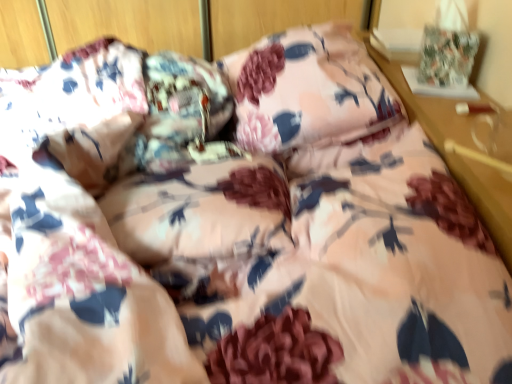
The width and height of the screenshot is (512, 384). I want to click on floral fabric pillow at center, so click(308, 90).

The width and height of the screenshot is (512, 384). Describe the element at coordinates (308, 90) in the screenshot. I see `floral fabric pillow at center` at that location.

Locate an element on the screen. This screenshot has width=512, height=384. floral fabric pillow at center is located at coordinates (308, 90).